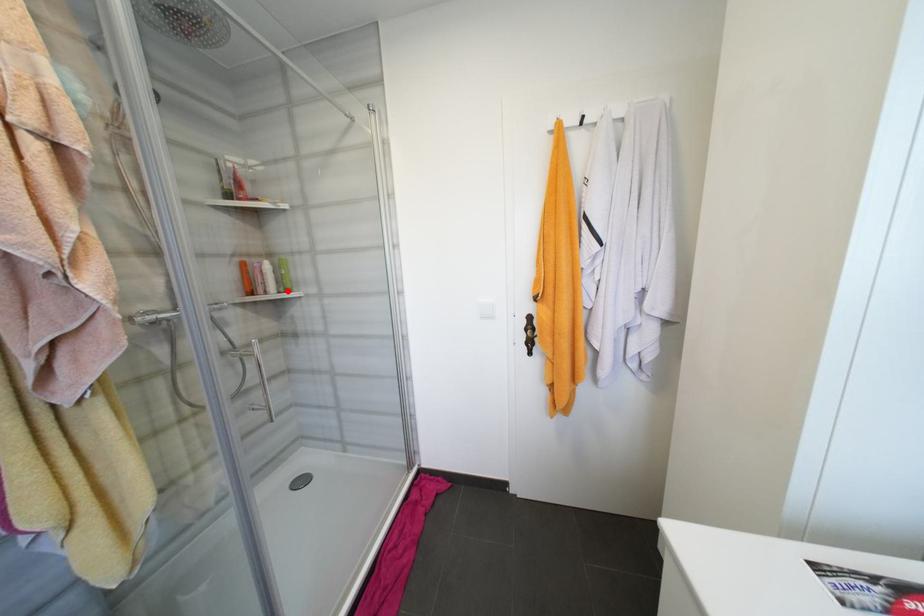
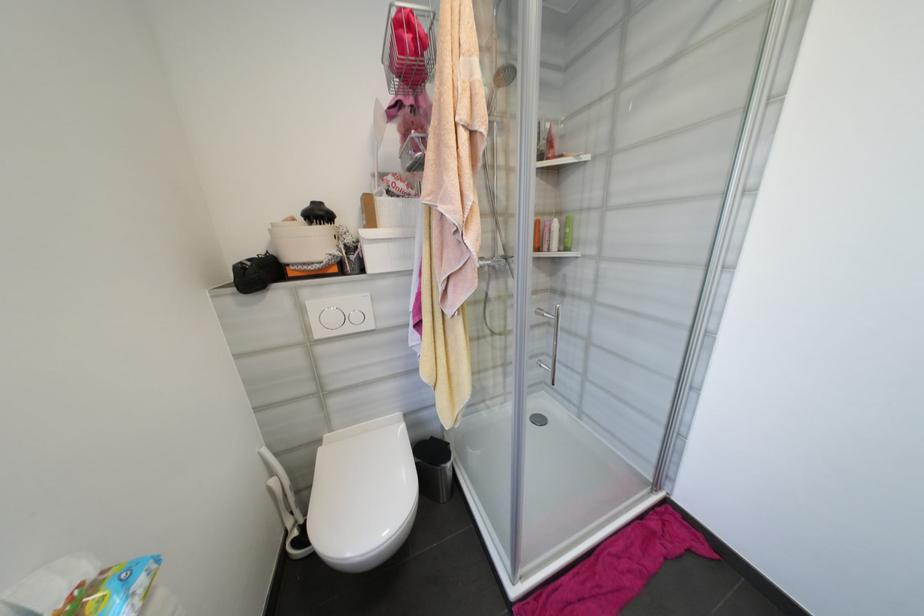
Where in the second image is the point corresponding to the highlighted location from the first image?

(567, 249)